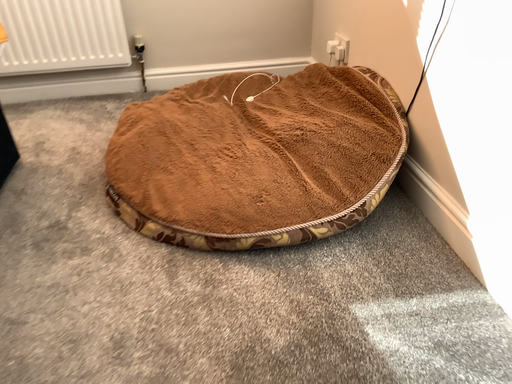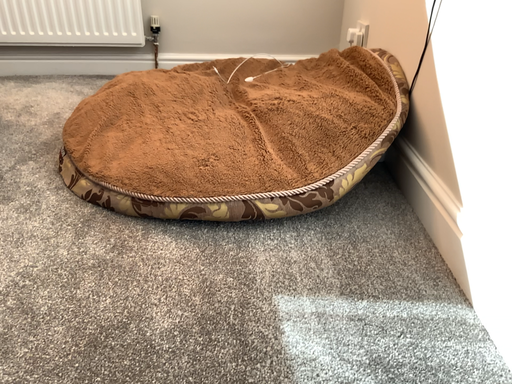
Question: How did the camera likely rotate when shooting the video?

Choices:
 (A) rotated right
 (B) rotated left

Answer: (B)